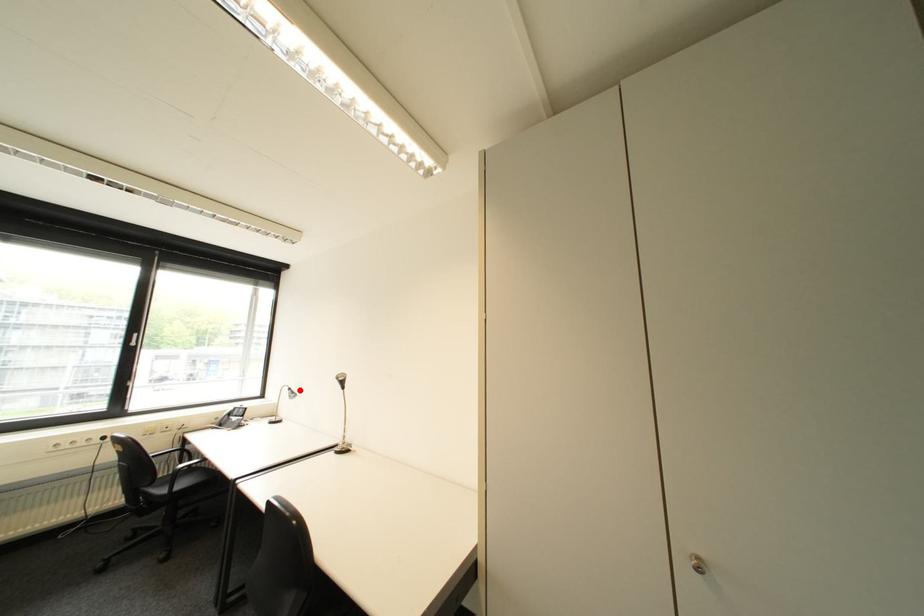
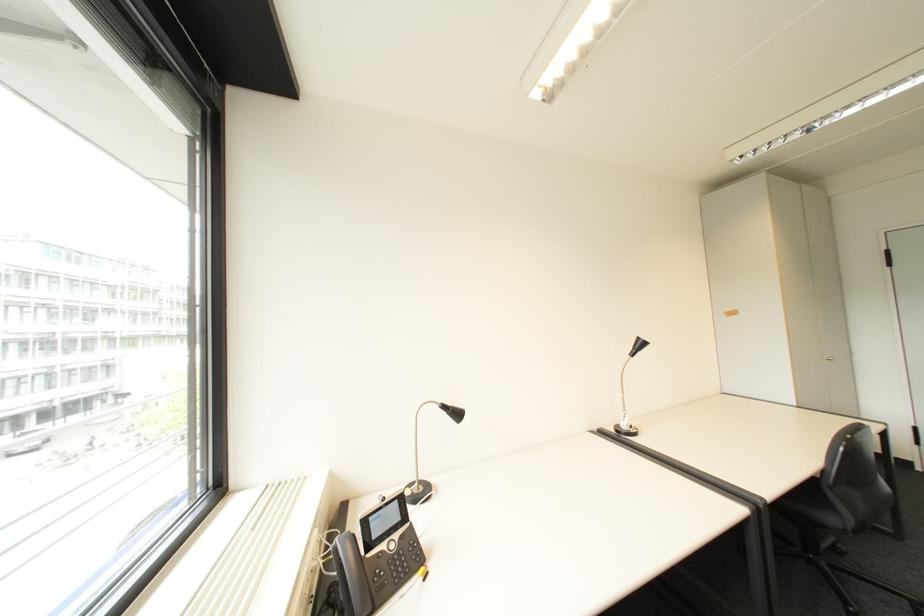
Question: I am providing you with two images of the same scene from different viewpoints. A red point is shown in image1. For the corresponding object point in image2, is it positioned nearer or farther from the camera?

Choices:
 (A) Nearer
 (B) Farther

Answer: (A)